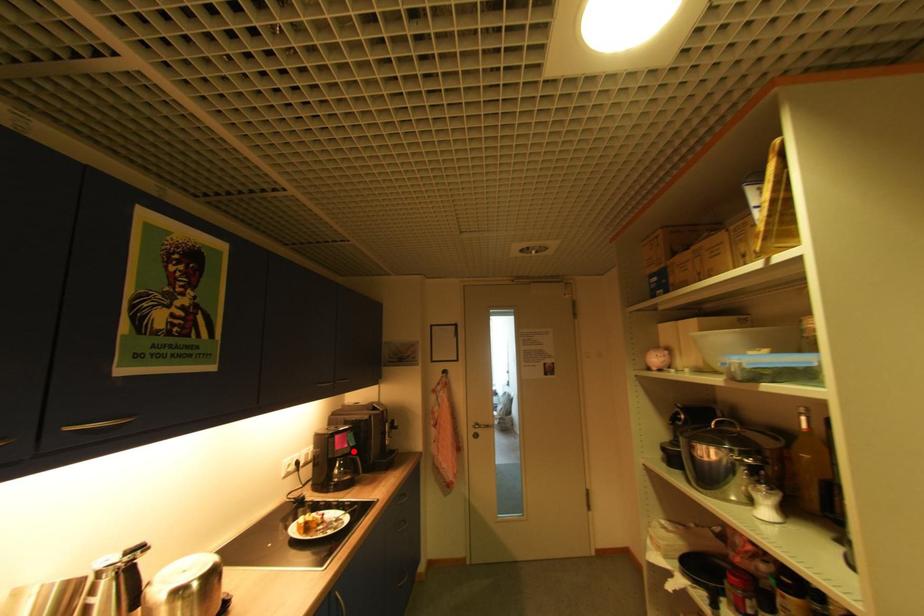
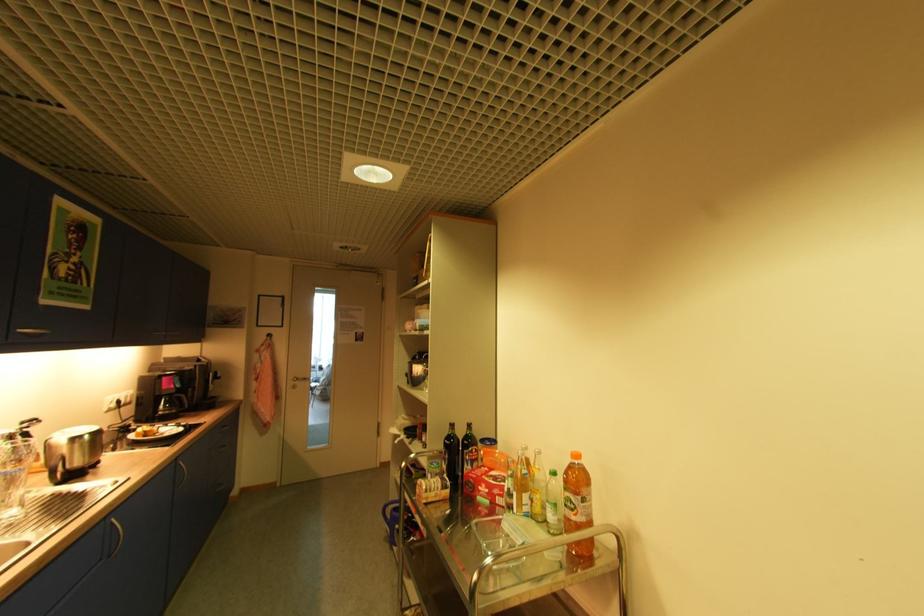
Where in the second image is the point corresponding to the highlighted location from the first image?

(178, 392)